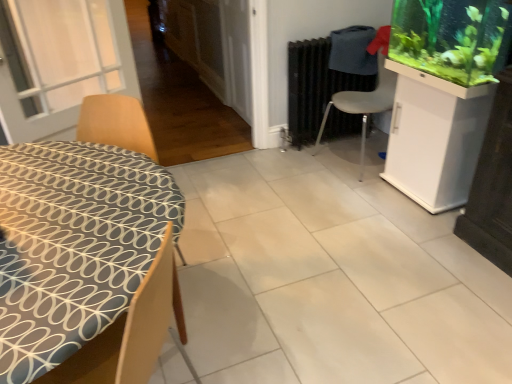
What do you see at coordinates (449, 37) in the screenshot? I see `green matte aquarium at upper right` at bounding box center [449, 37].

This screenshot has width=512, height=384. In order to click on wooden chair at left, positioned as the 1th chair in left-to-right order in this screenshot , I will do `click(88, 252)`.

You are a GUI agent. You are given a task and a screenshot of the screen. Output one action in this format:
    pyautogui.click(x=<x>, y=<y>)
    Task: Click on the black matte radiator at center
    The width and height of the screenshot is (512, 384).
    Given the screenshot: What is the action you would take?
    pyautogui.click(x=315, y=87)

From a real-world perspective, which object rests below the other?

white glossy cabinet at right.

In order to click on cabinetry that is below the black matte radiator at center (from the image's perspective) in this screenshot , I will do `click(435, 137)`.

Is white glossy cabinet at right not inside black matte radiator at center?

Yes.

Does white glossy cabinet at right have a greater height compared to black matte radiator at center?

No.

Does white plastic chair at center-right, the first chair viewed from the right, lie behind wooden chair at left, the first chair positioned from the front?

That is True.

From the image's perspective, which is below, white plastic chair at center-right, the 2th chair viewed from the front, or wooden chair at left, which ranks as the second chair in right-to-left order?

wooden chair at left, which ranks as the second chair in right-to-left order, appears lower in the image.

Which object is wider, white plastic chair at center-right, the 2th chair viewed from the front, or wooden chair at left, which ranks as the second chair in right-to-left order?

white plastic chair at center-right, the 2th chair viewed from the front, is wider.

Would you say green matte aquarium at upper right is to the left or to the right of white plastic chair at center-right, the first chair viewed from the right, in the picture?

From the image, it's evident that green matte aquarium at upper right is to the right of white plastic chair at center-right, the first chair viewed from the right.

Locate an element on the screen. The height and width of the screenshot is (384, 512). plant that is in front of the white plastic chair at center-right, the 2th chair viewed from the front is located at coordinates (449, 37).

From the picture: Considering the sizes of objects green matte aquarium at upper right and white plastic chair at center-right, the 1th chair viewed from the back, in the image provided, who is thinner, green matte aquarium at upper right or white plastic chair at center-right, the 1th chair viewed from the back,?

green matte aquarium at upper right.

Is green matte aquarium at upper right positioned beyond the bounds of white plastic chair at center-right, placed as the second chair when sorted from left to right?

green matte aquarium at upper right is positioned outside white plastic chair at center-right, placed as the second chair when sorted from left to right.

Consider the image. Is wooden chair at left, which ranks as the second chair in right-to-left order, touching white plastic chair at center-right, the first chair viewed from the right?

There is a gap between wooden chair at left, which ranks as the second chair in right-to-left order, and white plastic chair at center-right, the first chair viewed from the right.

Measure the distance from wooden chair at left, positioned as the 1th chair in left-to-right order, to white plastic chair at center-right, placed as the second chair when sorted from left to right.

A distance of 6.12 feet exists between wooden chair at left, positioned as the 1th chair in left-to-right order, and white plastic chair at center-right, placed as the second chair when sorted from left to right.

Image resolution: width=512 pixels, height=384 pixels. Find the location of `chair below the wooden chair at left, positioned as the 1th chair in left-to-right order (from a real-world perspective)`. chair below the wooden chair at left, positioned as the 1th chair in left-to-right order (from a real-world perspective) is located at coordinates (366, 94).

Is white glossy tile at center bigger or smaller than white plastic chair at center-right, the first chair viewed from the right?

Clearly, white glossy tile at center is smaller in size than white plastic chair at center-right, the first chair viewed from the right.

Which object is further away from the camera, white glossy tile at center or white plastic chair at center-right, the 2th chair viewed from the front?

white plastic chair at center-right, the 2th chair viewed from the front, is more distant.

Which is closer to the camera, [509,367] or [357,105]?

Point [509,367] is positioned closer to the camera compared to point [357,105].

From a real-world perspective, is white glossy tile at center located beneath white plastic chair at center-right, placed as the second chair when sorted from left to right?

Indeed, from a real-world perspective, white glossy tile at center is positioned beneath white plastic chair at center-right, placed as the second chair when sorted from left to right.

From the image's perspective, which is above, black matte radiator at center or white plastic chair at center-right, placed as the second chair when sorted from left to right?

black matte radiator at center is shown above in the image.

In the scene shown: Between black matte radiator at center and white plastic chair at center-right, placed as the second chair when sorted from left to right, which one has smaller width?

black matte radiator at center.

From a real-world perspective, which object rests below the other?

black matte radiator at center is physically lower.

Between black matte radiator at center and white glossy tile at center, which one has smaller width?

Thinner between the two is black matte radiator at center.

Is black matte radiator at center positioned far away from white glossy tile at center?

Yes.

You are a GUI agent. You are given a task and a screenshot of the screen. Output one action in this format:
    pyautogui.click(x=<x>, y=<y>)
    Task: Click on the radiator positioned vertically above the white glossy tile at center (from a real-world perspective)
    The height and width of the screenshot is (384, 512).
    Given the screenshot: What is the action you would take?
    pyautogui.click(x=315, y=87)

Which point is more distant from viewer, (314, 110) or (446, 222)?

The point (314, 110) is farther.

What are the coordinates of `cabinetry in front of the black matte radiator at center` in the screenshot? It's located at (435, 137).

Where is `chair that is behind the wooden chair at left, the first chair positioned from the front`? chair that is behind the wooden chair at left, the first chair positioned from the front is located at coordinates (366, 94).

Looking at the image, which one is located closer to white glossy tile at center, green matte aquarium at upper right or white glossy cabinet at right?

white glossy cabinet at right.

Based on their spatial positions, is white plastic chair at center-right, the 1th chair viewed from the back, or wooden chair at left, which is counted as the 2th chair, starting from the back, further from white glossy tile at center?

The object further to white glossy tile at center is white plastic chair at center-right, the 1th chair viewed from the back.

Looking at the image, which one is located further to wooden chair at left, the first chair positioned from the front, white plastic chair at center-right, the 1th chair viewed from the back, or white glossy cabinet at right?

white plastic chair at center-right, the 1th chair viewed from the back, lies further to wooden chair at left, the first chair positioned from the front, than the other object.

Looking at this image, which object lies nearer to the anchor point white glossy cabinet at right, green matte aquarium at upper right or white plastic chair at center-right, the 1th chair viewed from the back?

Based on the image, green matte aquarium at upper right appears to be nearer to white glossy cabinet at right.

Estimate the real-world distances between objects in this image. Which object is closer to white glossy cabinet at right, white plastic chair at center-right, placed as the second chair when sorted from left to right, or wooden chair at left, the first chair positioned from the front?

Among the two, white plastic chair at center-right, placed as the second chair when sorted from left to right, is located nearer to white glossy cabinet at right.

Based on their spatial positions, is black matte radiator at center or white glossy tile at center further from white glossy cabinet at right?

The object further to white glossy cabinet at right is black matte radiator at center.

Based on their spatial positions, is white glossy cabinet at right or wooden chair at left, which ranks as the second chair in right-to-left order, further from white plastic chair at center-right, the 2th chair viewed from the front?

Based on the image, wooden chair at left, which ranks as the second chair in right-to-left order, appears to be further to white plastic chair at center-right, the 2th chair viewed from the front.

When comparing their distances from white plastic chair at center-right, the first chair viewed from the right, does green matte aquarium at upper right or black matte radiator at center seem closer?

black matte radiator at center lies closer to white plastic chair at center-right, the first chair viewed from the right, than the other object.

At what (x,y) coordinates should I click in order to perform the action: click on plant between wooden chair at left, which ranks as the second chair in right-to-left order, and white glossy cabinet at right from left to right. Please return your answer as a coordinate pair (x, y). This screenshot has width=512, height=384. Looking at the image, I should click on [449, 37].

The height and width of the screenshot is (384, 512). I want to click on chair located between wooden chair at left, which is counted as the 2th chair, starting from the back, and white glossy cabinet at right in the left-right direction, so click(x=366, y=94).

This screenshot has width=512, height=384. In order to click on cabinetry between white glossy tile at center and white plastic chair at center-right, placed as the second chair when sorted from left to right, along the z-axis in this screenshot , I will do `click(435, 137)`.

This screenshot has height=384, width=512. What are the coordinates of `radiator located between wooden chair at left, which is counted as the 2th chair, starting from the back, and white glossy cabinet at right in the left-right direction` in the screenshot? It's located at (315, 87).